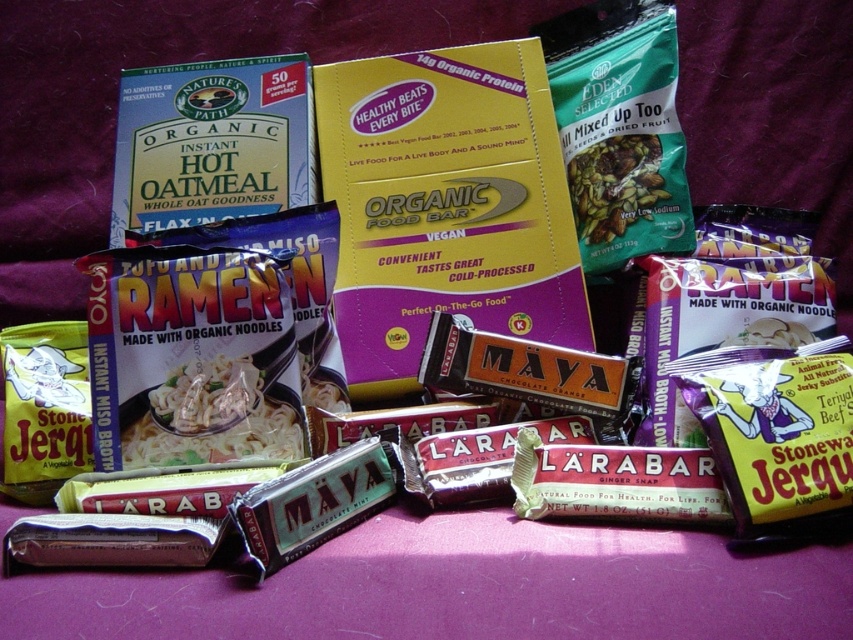
You are organizing a picnic and have both the chocolate bar at center and the green matte snack mix at center in your basket. If you want to place them on the picnic blanket so that the chocolate bar is above the green snack mix, how should you arrange them compared to their current positions in the image?

In the image, the chocolate bar at center is below the green matte snack mix at center. To place the chocolate bar above the green snack mix, you need to move it upwards so that it is positioned higher than the green matte snack mix at center.

What is located at the point with coordinates (614, 481)?

The point at coordinates (614, 481) corresponds to the chocolate bar at center.